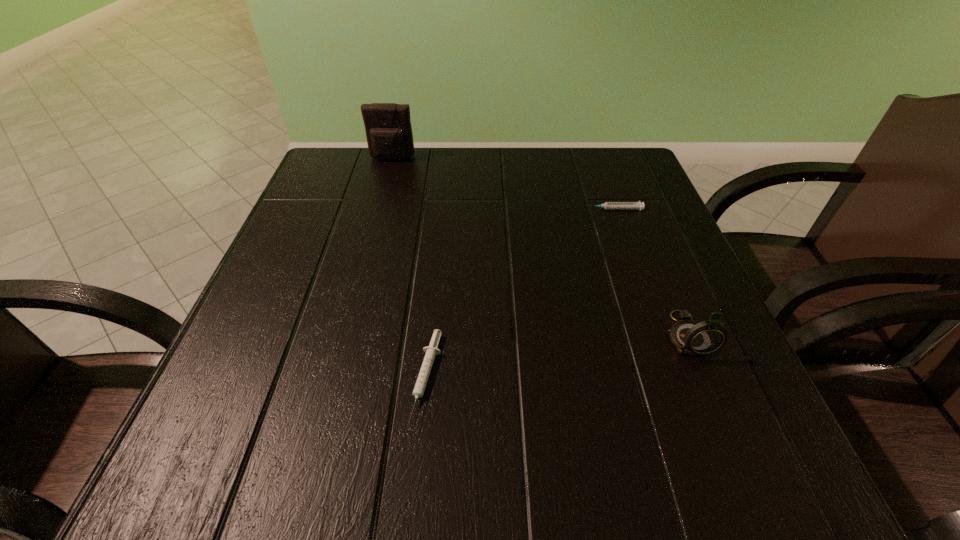
At what (x,y) coordinates should I click in order to perform the action: click on free area in between the farther syringe and the leftmost object. Please return your answer as a coordinate pair (x, y). The height and width of the screenshot is (540, 960). Looking at the image, I should click on (x=503, y=184).

Find the location of a particular element. vacant space that's between the farthest object and the farther syringe is located at coordinates (503, 184).

Image resolution: width=960 pixels, height=540 pixels. I want to click on vacant area that lies between the compass and the third nearest object, so click(x=650, y=272).

I want to click on vacant area between the second farthest object and the pouch, so click(503, 184).

At what (x,y) coordinates should I click in order to perform the action: click on the second closest object relative to the pouch. Please return your answer as a coordinate pair (x, y). Image resolution: width=960 pixels, height=540 pixels. Looking at the image, I should click on (431, 351).

Identify which object is located as the second nearest to the pouch. Please provide its 2D coordinates. Your answer should be formatted as a tuple, i.e. [(x, y)], where the tuple contains the x and y coordinates of a point satisfying the conditions above.

[(431, 351)]

Locate an element on the screen. This screenshot has height=540, width=960. vacant space that satisfies the following two spatial constraints: 1. with an open flap on the nearer syringe; 2. on the right side of the tallest object is located at coordinates (333, 377).